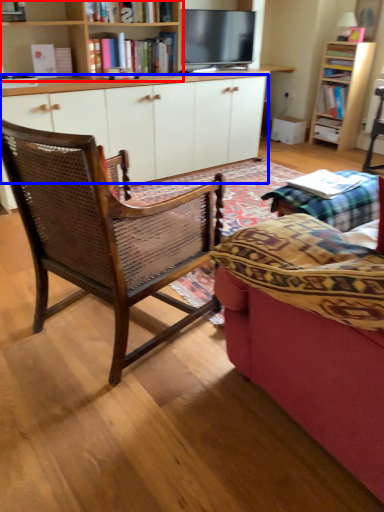
Question: Which object is closer to the camera taking this photo, bookcase (highlighted by a red box) or cabinetry (highlighted by a blue box)?

Choices:
 (A) bookcase
 (B) cabinetry

Answer: (A)